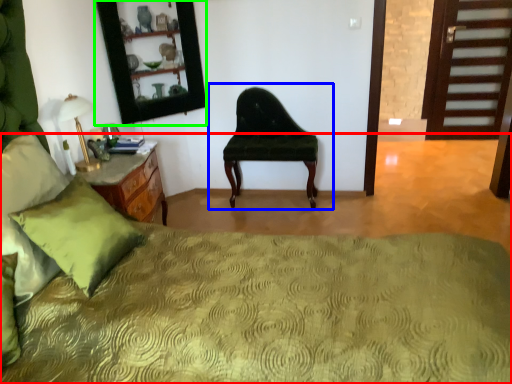
Question: Which object is the closest to the bed (highlighted by a red box)? Choose among these: chair (highlighted by a blue box) or mirror (highlighted by a green box).

Choices:
 (A) chair
 (B) mirror

Answer: (A)